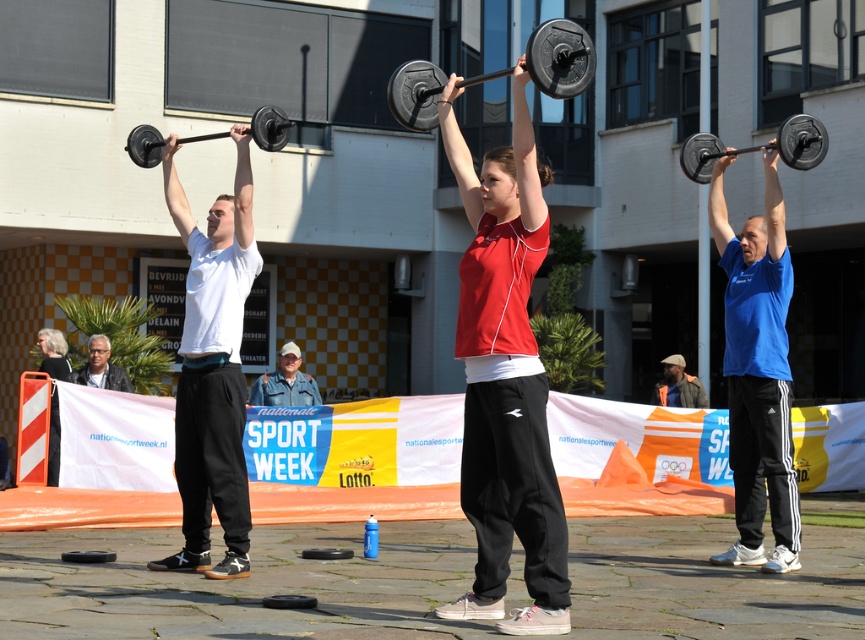
Which is in front, point (234, 177) or point (497, 196)?

Point (497, 196) is in front.

Is point (228, 406) closer to camera compared to point (492, 170)?

No, (228, 406) is behind (492, 170).

Between point (180, 477) and point (509, 172), which one is positioned behind?

The point (180, 477) is more distant.

This screenshot has width=865, height=640. I want to click on white matte shirt at center, so click(210, 392).

Which is behind, point (287, 384) or point (101, 346)?

The point (101, 346) is behind.

Is point (315, 381) less distant than point (97, 369)?

No, it is behind (97, 369).

Is point (293, 384) behind point (93, 348)?

Yes, point (293, 384) is behind point (93, 348).

You are a GUI agent. You are given a task and a screenshot of the screen. Output one action in this format:
    pyautogui.click(x=<x>, y=<y>)
    Task: Click on the khaki fabric cap at center
    
    Given the screenshot: What is the action you would take?
    pyautogui.click(x=285, y=381)

Is black rubber barbell at center further to the viewer compared to khaki fabric cap at center?

No.

Can you confirm if black rubber barbell at center is thinner than khaki fabric cap at center?

Correct, black rubber barbell at center's width is less than khaki fabric cap at center's.

Does point (389, 106) come behind point (295, 358)?

That is False.

Locate an element on the screen. This screenshot has width=865, height=640. black rubber barbell at center is located at coordinates (561, 58).